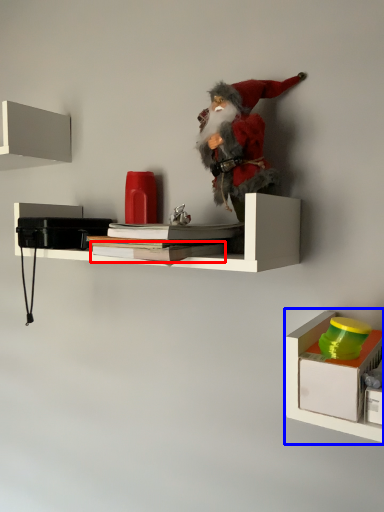
Question: Which of the following is the closest to the observer, book (highlighted by a red box) or shelf (highlighted by a blue box)?

Choices:
 (A) book
 (B) shelf

Answer: (B)